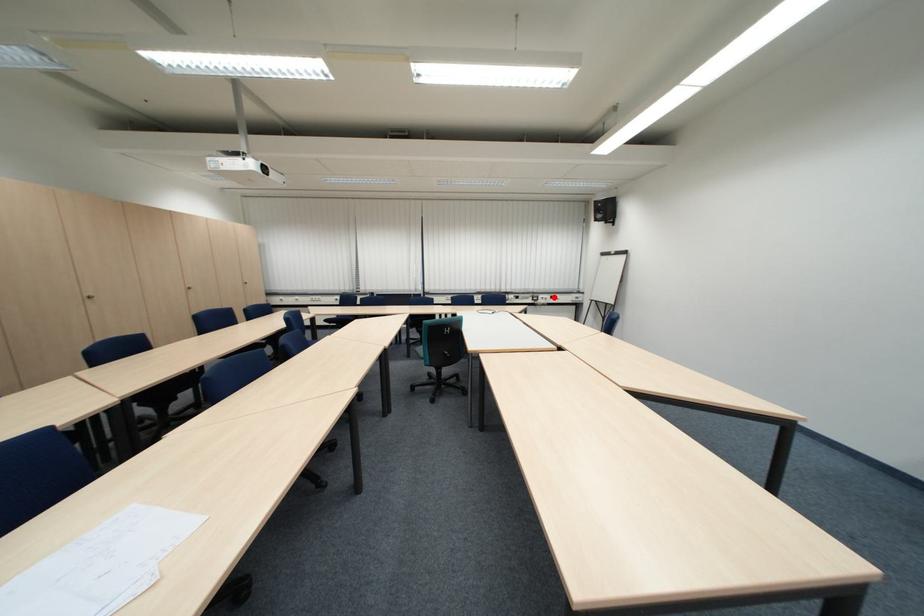
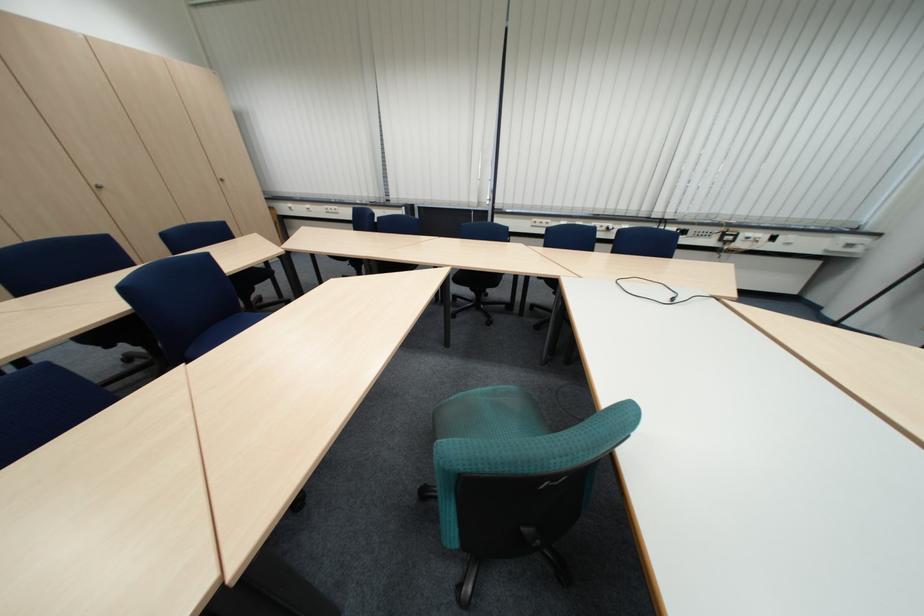
Find the pixel in the second image that matches the highlighted location in the first image.

(759, 235)